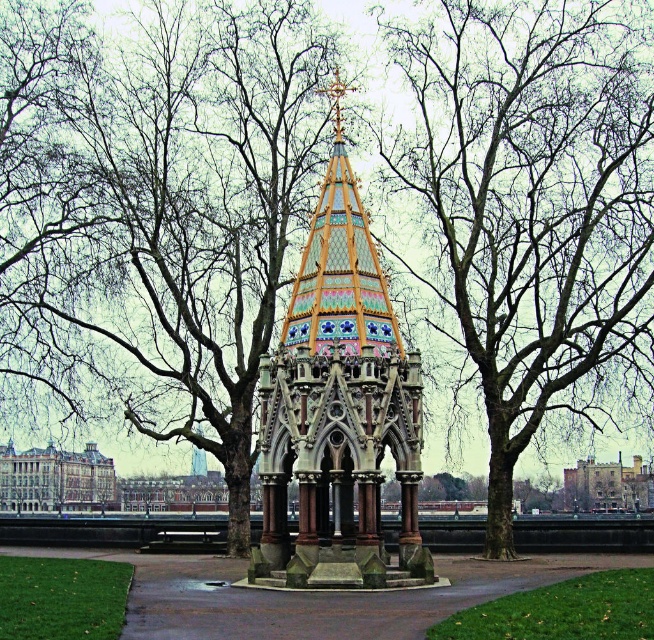
You are standing in the park and see both the multicolored mosaic gazebo at center and the brown stone church at center. Which one is located to the right of the other?

The multicolored mosaic gazebo at center is positioned on the right side of brown stone church at center.

You are planning to host a small outdoor event and need to choose between the multicolored mosaic gazebo at center and the brown stone church at center for the ceremony. Based on their widths, which structure would allow more guests to stand comfortably inside?

The brown stone church at center has a greater width than the multicolored mosaic gazebo at center, so it can accommodate more guests comfortably.

You are planning to host a small outdoor event and need to choose between the multicolored mosaic gazebo at center and the brick stone church at center. Based on their sizes, which one would you recommend for accommodating more guests?

The multicolored mosaic gazebo at center is bigger than the brick stone church at center, so it can accommodate more guests.